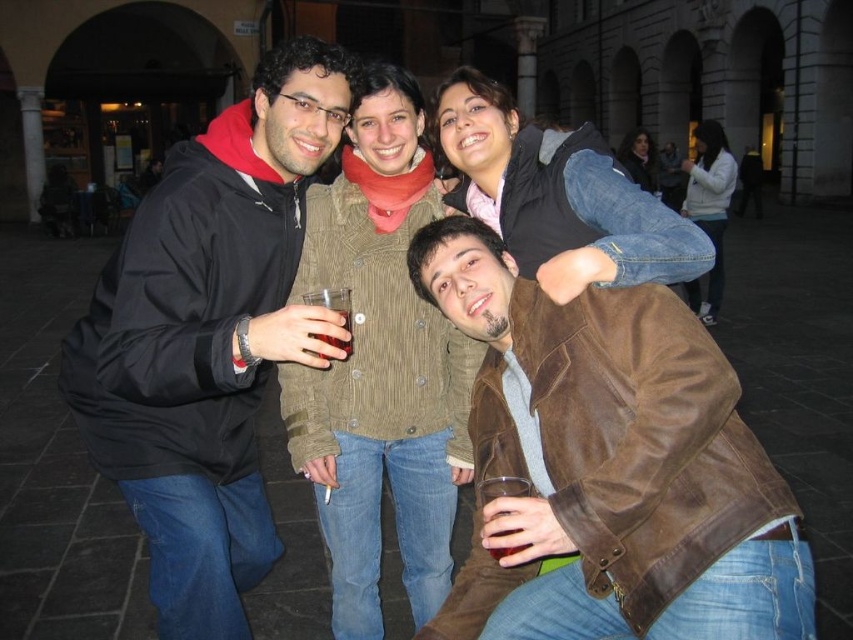
Between black jacket at left and translucent glass at center, which one appears on the right side from the viewer's perspective?

translucent glass at center is more to the right.

The image size is (853, 640). Describe the element at coordinates (207, 337) in the screenshot. I see `black jacket at left` at that location.

Who is more distant from viewer, (158, 589) or (344, 321)?

Positioned behind is point (344, 321).

At what (x,y) coordinates should I click in order to perform the action: click on black jacket at left. Please return your answer as a coordinate pair (x, y). Image resolution: width=853 pixels, height=640 pixels. Looking at the image, I should click on (207, 337).

Measure the distance between point (639, 490) and camera.

7.04 meters

Between point (692, 589) and point (189, 536), which one is positioned behind?

The point (189, 536) is more distant.

Does point (633, 560) lie in front of point (192, 355)?

Yes, it is.

Identify the location of brown suede jacket at lower right. (608, 465).

Is brown suede jacket at lower right shorter than translucent glass at center?

No, brown suede jacket at lower right is not shorter than translucent glass at center.

Can you confirm if brown suede jacket at lower right is smaller than translucent glass at center?

Incorrect, brown suede jacket at lower right is not smaller in size than translucent glass at center.

Does point (607, 378) come farther from viewer compared to point (332, 307)?

No, (607, 378) is closer to viewer.

Find the location of a particular element. The image size is (853, 640). brown suede jacket at lower right is located at coordinates tap(608, 465).